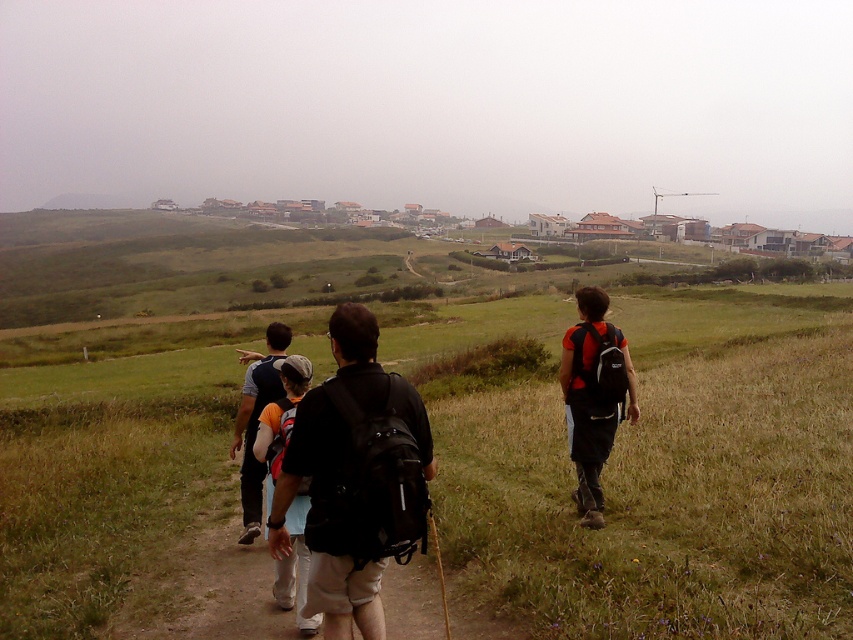
You are a hiker trying to cross the dirt path. You see the green grassy at center and orange fabric backpack at right. Which object is wider?

The green grassy at center might be wider than orange fabric backpack at right.

You are a photographer standing at the camera position. You want to take a photo of the orange fabric backpack at center. Can you reach it by walking straight ahead without moving sideways?

The orange fabric backpack at center and camera are 5.07 meters apart from each other, so yes, you can reach it by walking straight ahead since the distance is manageable.